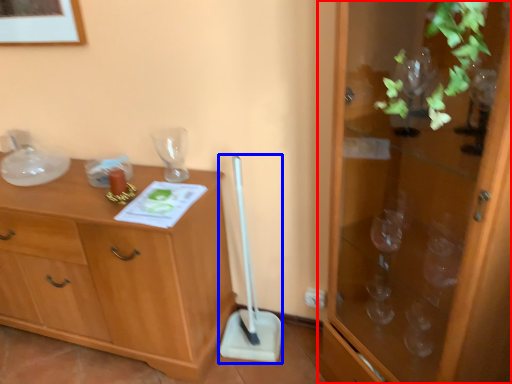
Question: Which of the following is the farthest to the observer, cabinetry (highlighted by a red box) or shovel (highlighted by a blue box)?

Choices:
 (A) cabinetry
 (B) shovel

Answer: (B)